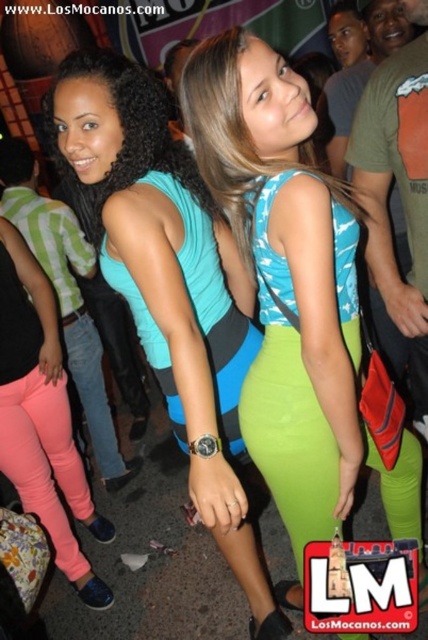
You are at a party and want to find the teal fabric dress at center. There is a point marked at coordinates (168, 282). Is this point located on the teal fabric dress at center?

Yes, the point at coordinates (168, 282) is located on the teal fabric dress at center according to the description.

You are a photographer at the event and want to capture a photo where both the blue fabric dress at center and the teal fabric dress at center are visible in the frame. Given their height difference, which dress will appear larger in the photo?

The blue fabric dress at center will appear larger in the photo because it is much taller than the teal fabric dress at center.

You are a photographer at the party and need to decide which outfit takes up more space in the frame. Which one is larger between the teal fabric dress at center and the pink matte leggings at lower left?

The teal fabric dress at center is bigger than the pink matte leggings at lower left, so it takes up more space in the frame.